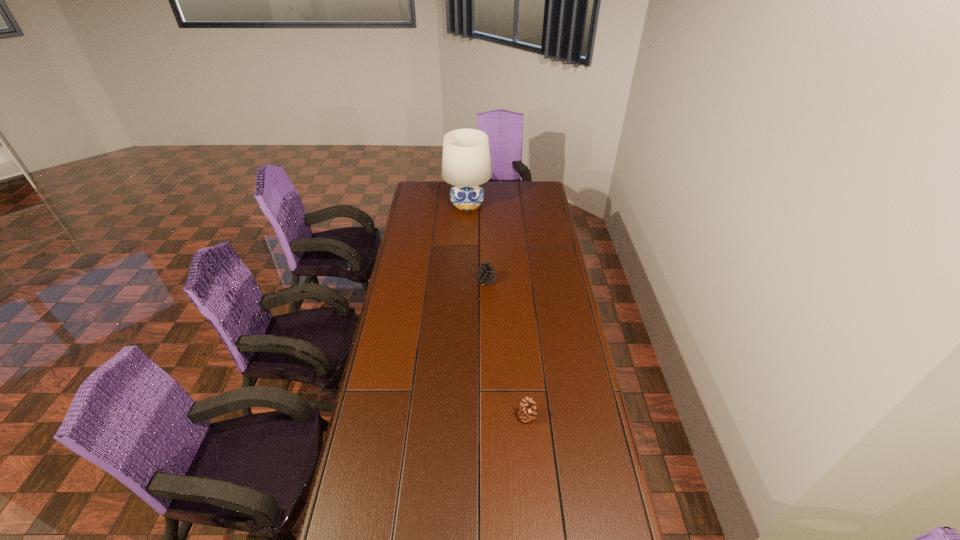
I want to click on vacant space that satisfies the following two spatial constraints: 1. on the front-facing side of the tallest object; 2. on the right side of the farther pinecone, so click(465, 281).

Identify the location of blank space that satisfies the following two spatial constraints: 1. on the front-facing side of the farthest object; 2. on the left side of the second farthest object. The height and width of the screenshot is (540, 960). (465, 281).

Identify the location of free spot that satisfies the following two spatial constraints: 1. on the front-facing side of the rightmost object; 2. on the right side of the tallest object. The width and height of the screenshot is (960, 540). (459, 417).

At what (x,y) coordinates should I click in order to perform the action: click on free space in the image that satisfies the following two spatial constraints: 1. on the front side of the right pinecone; 2. on the right side of the left pinecone. Please return your answer as a coordinate pair (x, y). The height and width of the screenshot is (540, 960). Looking at the image, I should click on (489, 417).

I want to click on free space that satisfies the following two spatial constraints: 1. on the front-facing side of the tallest object; 2. on the right side of the second nearest object, so click(x=465, y=281).

Where is `vacant point that satisfies the following two spatial constraints: 1. on the front-facing side of the lampshade; 2. on the right side of the farther pinecone`? vacant point that satisfies the following two spatial constraints: 1. on the front-facing side of the lampshade; 2. on the right side of the farther pinecone is located at coordinates (465, 281).

Where is `vacant space that satisfies the following two spatial constraints: 1. on the front-facing side of the tallest object; 2. on the left side of the nearest object`? vacant space that satisfies the following two spatial constraints: 1. on the front-facing side of the tallest object; 2. on the left side of the nearest object is located at coordinates (459, 417).